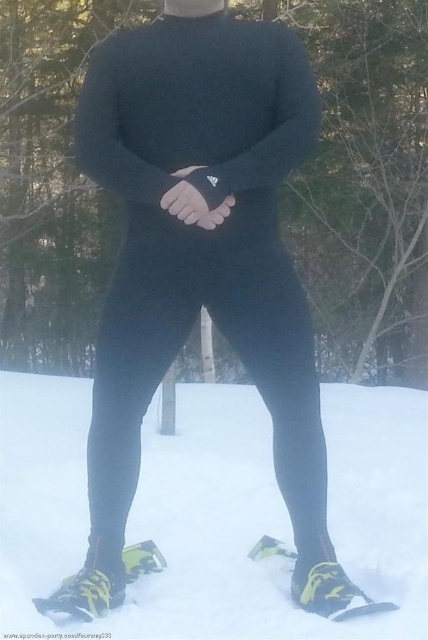
Measure the distance from yellow-green plastic snowshoes at lower center to black matte leggings at center.

They are 54.82 centimeters apart.

Can you confirm if yellow-green plastic snowshoes at lower center is taller than black matte leggings at center?

No, yellow-green plastic snowshoes at lower center is not taller than black matte leggings at center.

Is point (332, 465) positioned behind point (262, 292)?

Yes, point (332, 465) is behind point (262, 292).

You are a GUI agent. You are given a task and a screenshot of the screen. Output one action in this format:
    pyautogui.click(x=<x>, y=<y>)
    Task: Click on the yellow-green plastic snowshoes at lower center
    The width and height of the screenshot is (428, 640).
    Given the screenshot: What is the action you would take?
    [x=214, y=509]